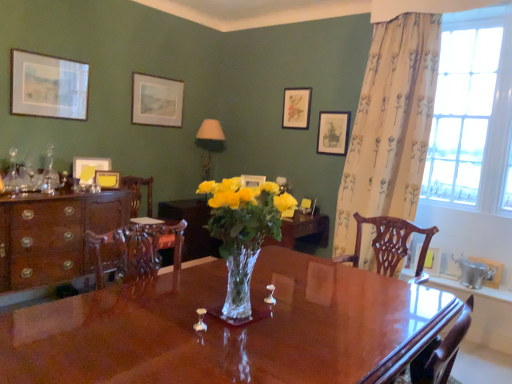
Where is `free space below clear glass vase at center (from a real-world perspective)`? The width and height of the screenshot is (512, 384). free space below clear glass vase at center (from a real-world perspective) is located at coordinates (239, 319).